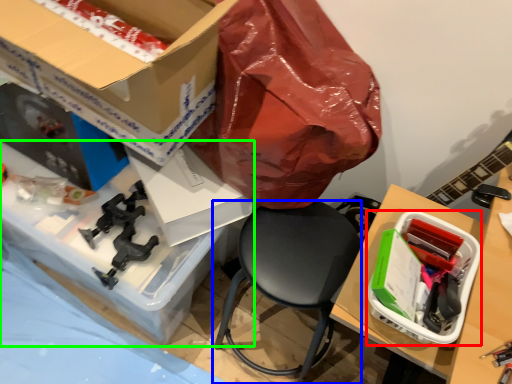
Question: Which object is the closest to the box (highlighted by a red box)? Choose among these: chair (highlighted by a blue box) or desk (highlighted by a green box).

Choices:
 (A) chair
 (B) desk

Answer: (A)